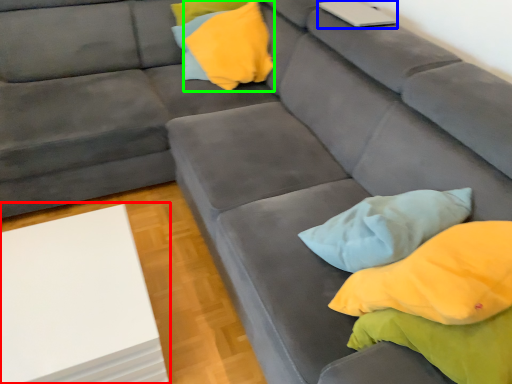
Question: Which object is positioned farthest from table (highlighted by a red box)? Select from laptop (highlighted by a blue box) and pillow (highlighted by a green box).

Choices:
 (A) laptop
 (B) pillow

Answer: (A)